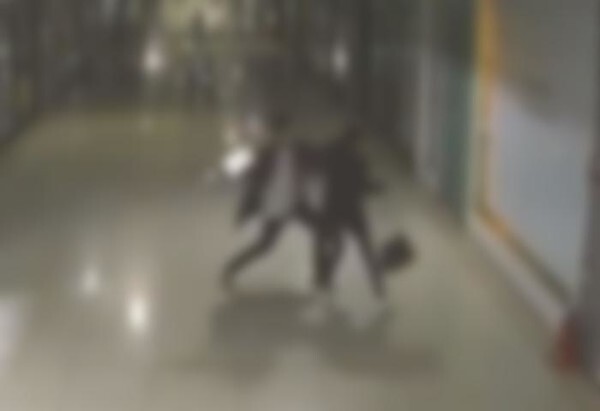
The image size is (600, 411). In order to click on wall in this screenshot , I will do `click(560, 138)`.